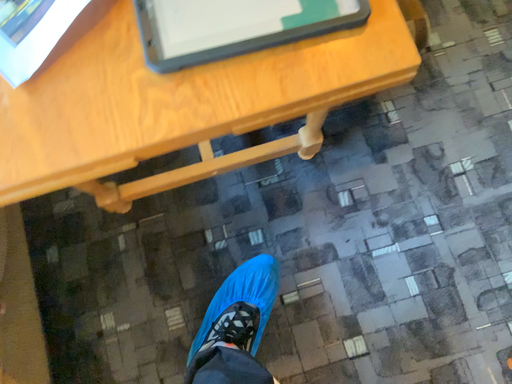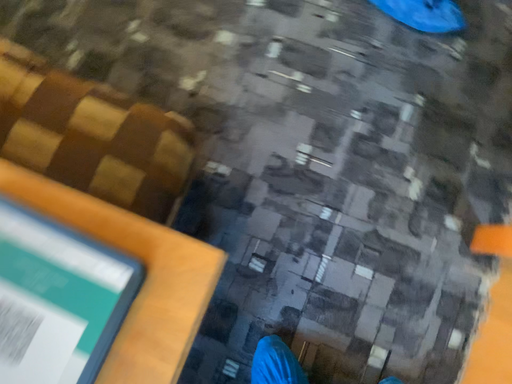
Question: How did the camera likely rotate when shooting the video?

Choices:
 (A) rotated left
 (B) rotated right

Answer: (B)